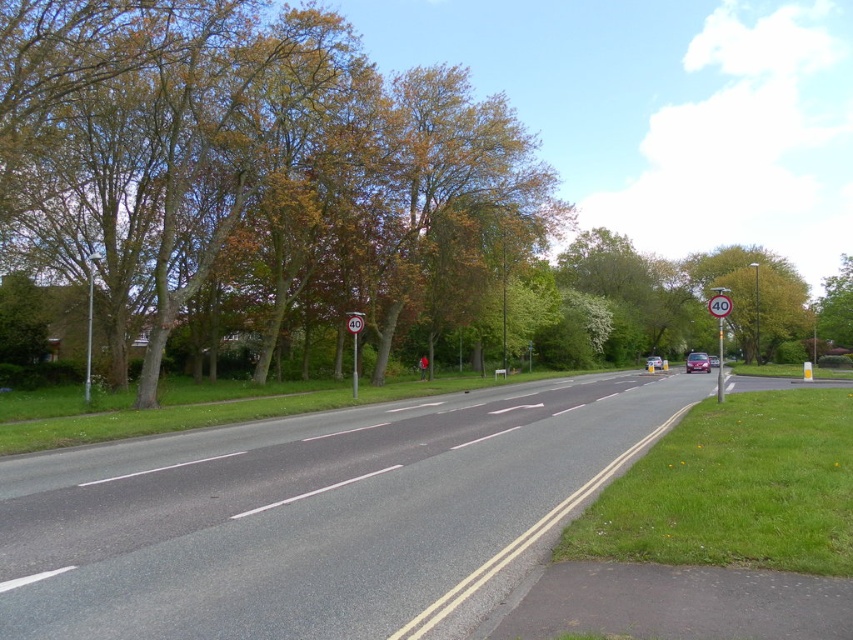
Is point (827, 348) behind point (354, 326)?

Yes, point (827, 348) is behind point (354, 326).

Between green leafy tree at upper right and white plastic speed limit sign at center, which one appears on the right side from the viewer's perspective?

green leafy tree at upper right

This screenshot has width=853, height=640. In order to click on green leafy tree at upper right in this screenshot , I will do `click(836, 308)`.

Between white plastic speed limit sign at center and metallic silver car at center, which one appears on the right side from the viewer's perspective?

From the viewer's perspective, metallic silver car at center appears more on the right side.

Based on the photo, can you confirm if white plastic speed limit sign at center is positioned to the left of metallic silver car at center?

Yes, white plastic speed limit sign at center is to the left of metallic silver car at center.

Between point (354, 324) and point (646, 364), which one is positioned in front?

Positioned in front is point (354, 324).

You are a GUI agent. You are given a task and a screenshot of the screen. Output one action in this format:
    pyautogui.click(x=<x>, y=<y>)
    Task: Click on the white plastic speed limit sign at center
    
    Given the screenshot: What is the action you would take?
    pyautogui.click(x=354, y=344)

Is the position of green leafy tree at upper right less distant than that of metallic silver car at center?

No.

Can you confirm if green leafy tree at upper right is taller than metallic silver car at center?

Yes, green leafy tree at upper right is taller than metallic silver car at center.

In order to click on green leafy tree at upper right in this screenshot , I will do `click(836, 308)`.